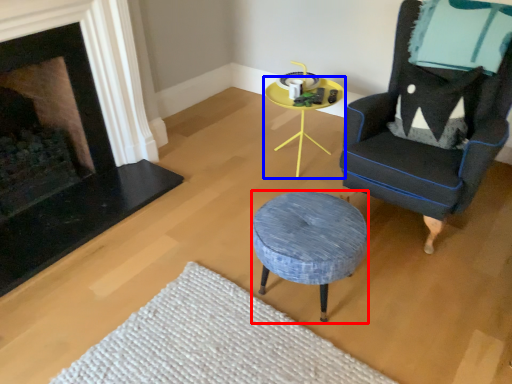
Question: Which point is further to the camera, stool (highlighted by a red box) or table (highlighted by a blue box)?

Choices:
 (A) stool
 (B) table

Answer: (B)